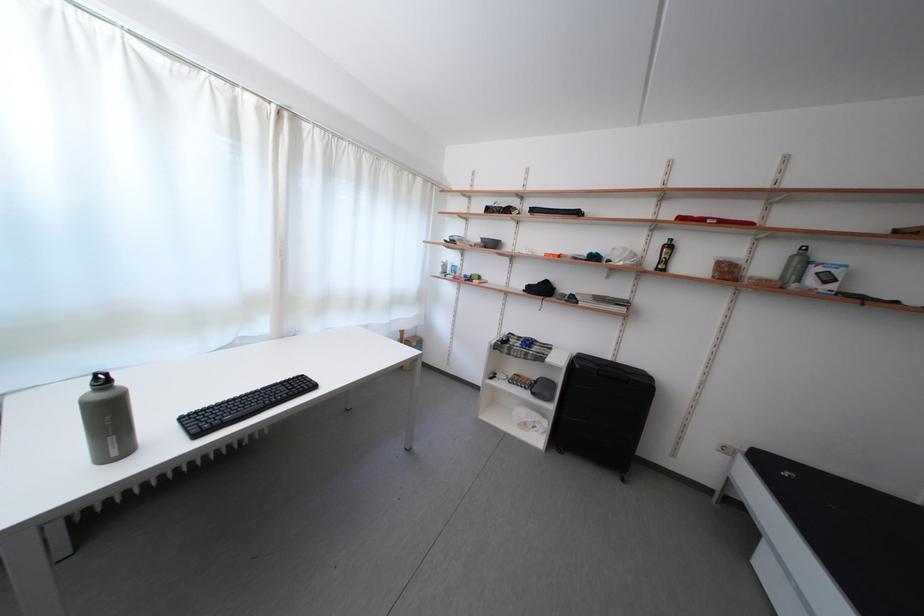
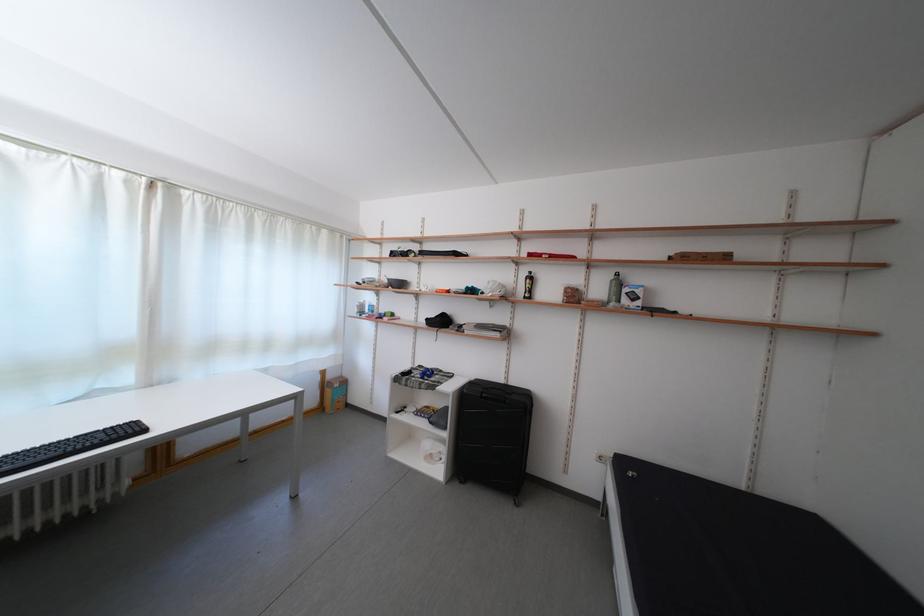
Question: The first image is from the beginning of the video and the second image is from the end. How did the camera likely rotate when shooting the video?

Choices:
 (A) Left
 (B) Right
 (C) Up
 (D) Down

Answer: (C)